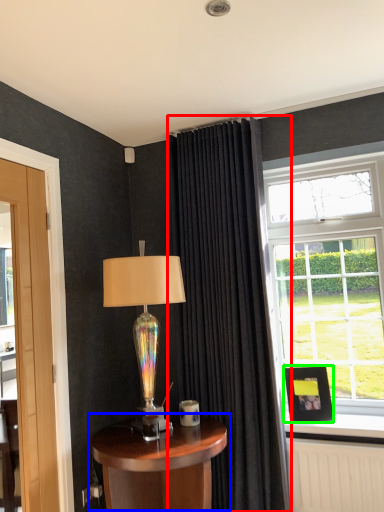
Question: Based on their relative distances, which object is farther from curtain (highlighted by a red box)? Choose from table (highlighted by a blue box) and picture frame (highlighted by a green box).

Choices:
 (A) table
 (B) picture frame

Answer: (A)